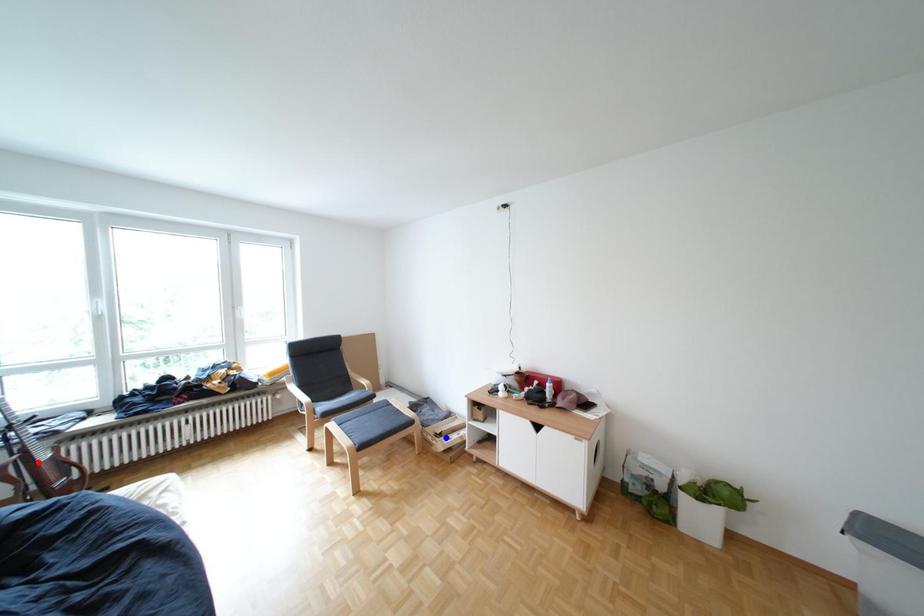
Question: Which of the two points in the image is closer to the camera?

Choices:
 (A) Blue point is closer.
 (B) Red point is closer.

Answer: (B)